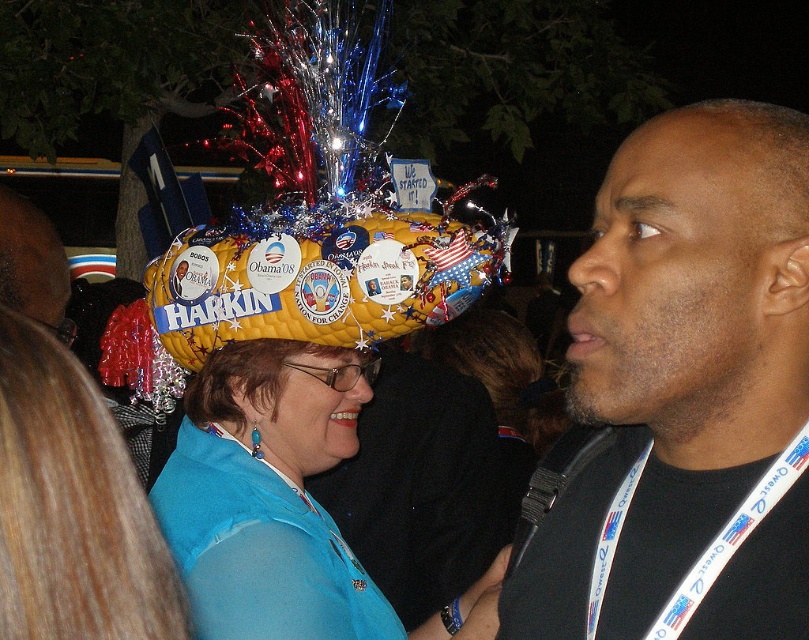
You are at a political rally and see the black lanyard at right. Where exactly is it located in the image?

The black lanyard at right is located at the coordinates point (683, 396) in the image.

You are at the political rally and want to take a photo of the black lanyard at right. Based on its position, where should you aim your camera?

The black lanyard at right is located at point 0.619 on the x and 0.845 on the y coordinates, so aim your camera towards the upper right area of the image.